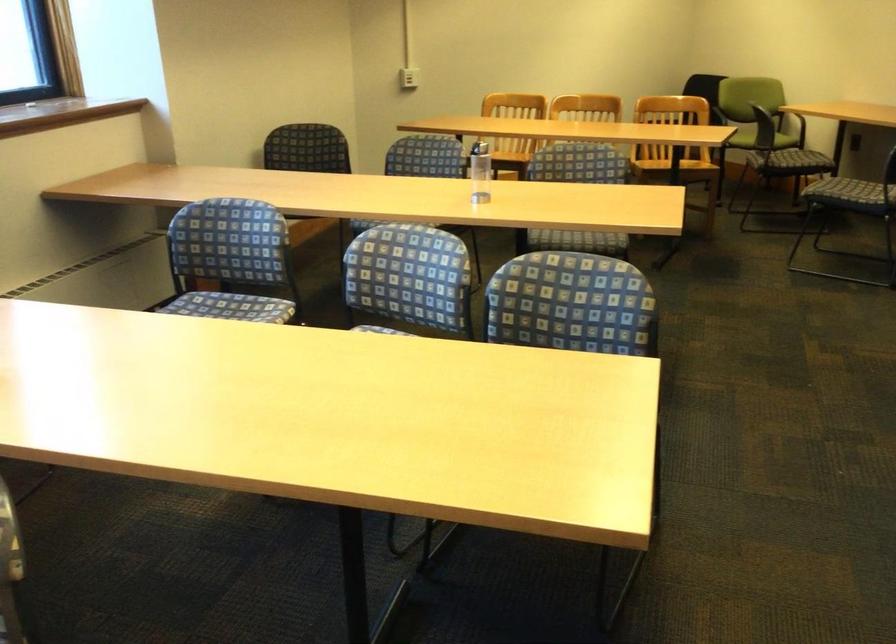
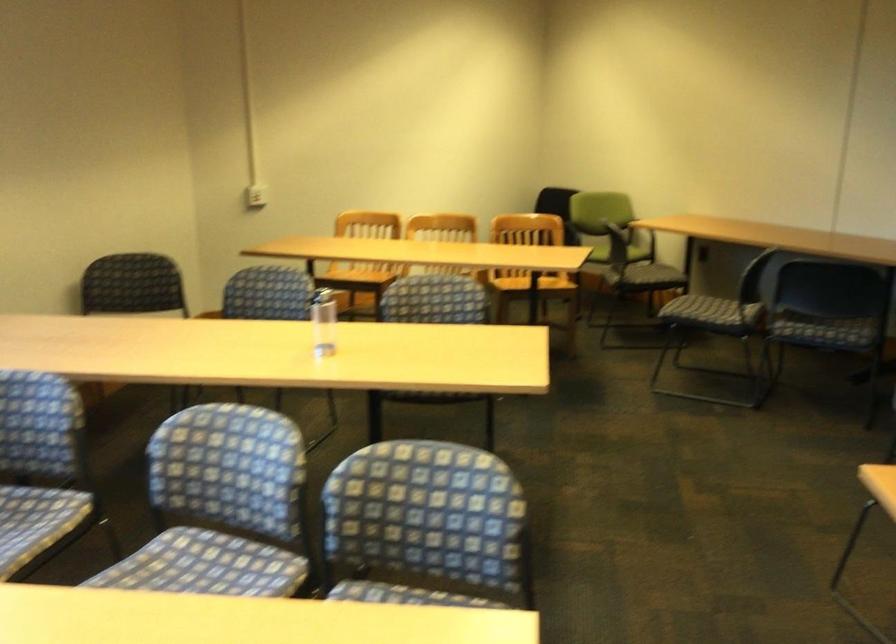
In the second image, find the point that corresponds to point 401,305 in the first image.

(221, 506)